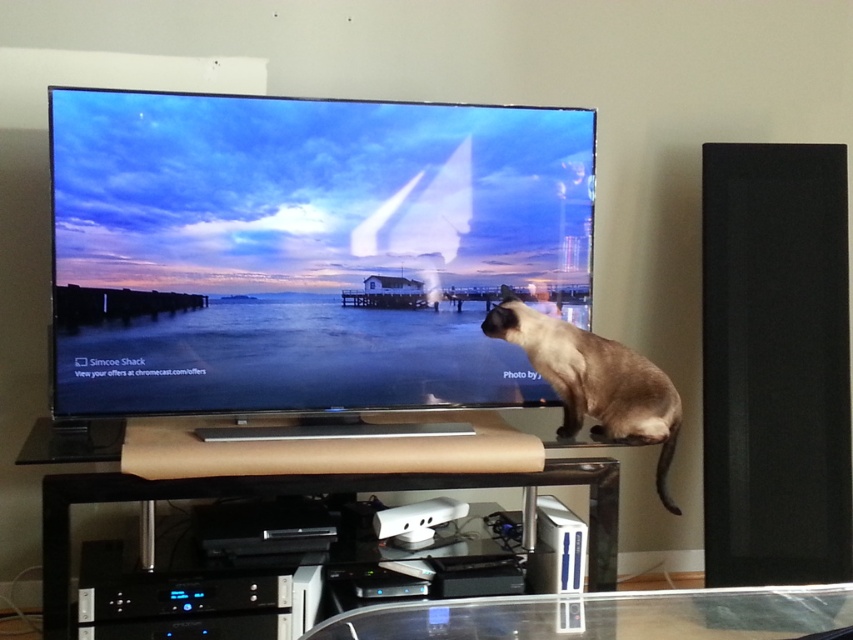
Question: Which object is positioned farthest from the transparent glass entertainment center at lower center?

Choices:
 (A) transparent glass table at lower center
 (B) matte black flat screen tv at center
 (C) smokey brown fur at upper right

Answer: (A)

Question: Which point is farther to the camera?

Choices:
 (A) transparent glass table at lower center
 (B) matte black flat screen tv at center

Answer: (B)

Question: Which of the following is the closest to the observer?

Choices:
 (A) (527, 330)
 (B) (341, 177)
 (C) (722, 605)
 (D) (51, 531)

Answer: (C)

Question: Can you confirm if matte black flat screen tv at center is thinner than smokey brown fur at upper right?

Choices:
 (A) yes
 (B) no

Answer: (B)

Question: Can you confirm if matte black flat screen tv at center is positioned to the right of transparent glass entertainment center at lower center?

Choices:
 (A) no
 (B) yes

Answer: (B)

Question: Does matte black flat screen tv at center have a smaller size compared to transparent glass table at lower center?

Choices:
 (A) yes
 (B) no

Answer: (B)